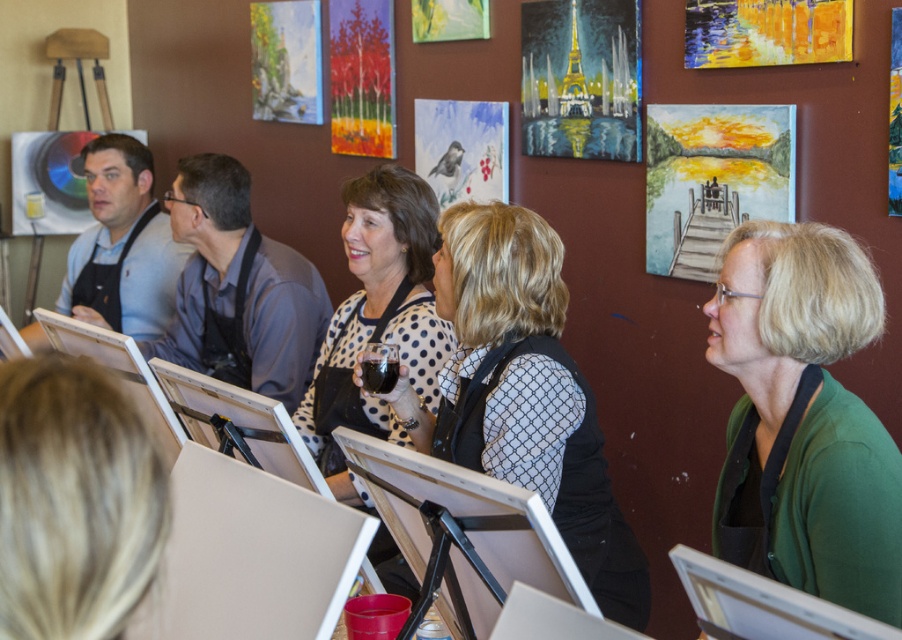
You are an art student who wants to hang a new artwork between the matte paper bird on the right and the pastel landscape painting at upper center. Which object should you place closer to the center of the wall to maintain balance?

The matte paper bird on the right is thinner than the pastel landscape painting at upper center. To maintain balance, place the thinner matte paper bird on the right closer to the center so it visually balances with the larger pastel landscape painting at upper center.

You are an art student in the room looking at the two paintings on the wall. You want to see the pastel oil painting of trees at upper center clearly. Is it possible to see it without moving the pastel landscape painting at upper center?

The pastel oil painting of trees at upper center is behind the pastel landscape painting at upper center, so you cannot see it clearly without moving the pastel landscape painting at upper center.

You are an artist in the art class and want to place your green matte cardigan at center on a shelf that can only hold items narrower than the yellow acrylic painting at upper right. Will the cardigan fit?

The green matte cardigan at center is narrower than the yellow acrylic painting at upper right, so it will fit on the shelf.